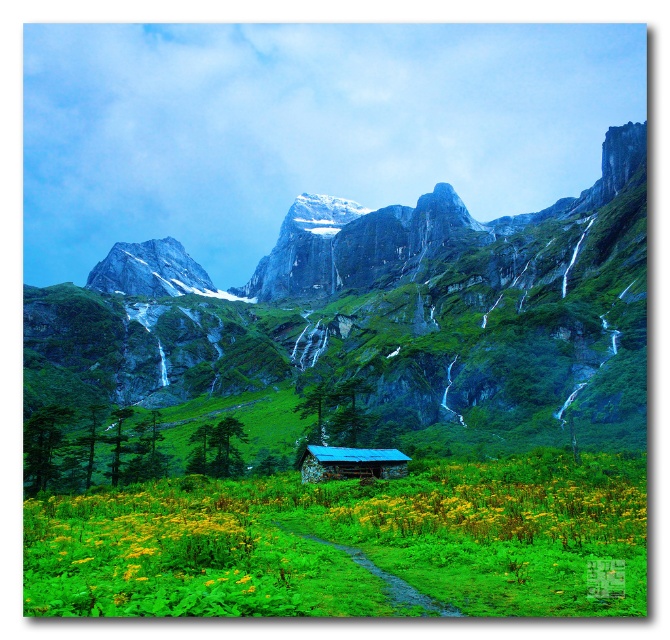
Between yellow matte flower at lower center and rustic wooden cabin at center, which one is positioned lower?

yellow matte flower at lower center

What do you see at coordinates (507, 513) in the screenshot?
I see `yellow matte flower at lower center` at bounding box center [507, 513].

The width and height of the screenshot is (670, 640). I want to click on yellow matte flower at lower center, so click(x=507, y=513).

Which of these two, green grassy field at lower center or rustic wooden cabin at center, stands taller?

With more height is green grassy field at lower center.

Between green grassy field at lower center and rustic wooden cabin at center, which one appears on the left side from the viewer's perspective?

From the viewer's perspective, green grassy field at lower center appears more on the left side.

Between point (417, 208) and point (299, 472), which one is positioned behind?

The point (417, 208) is more distant.

In order to click on green grassy field at lower center in this screenshot , I will do pos(366,330).

Does green grassy field at lower center have a greater height compared to green grassy path at center?

Indeed, green grassy field at lower center has a greater height compared to green grassy path at center.

Which is more to the right, green grassy field at lower center or green grassy path at center?

Positioned to the right is green grassy path at center.

I want to click on green grassy field at lower center, so click(366, 330).